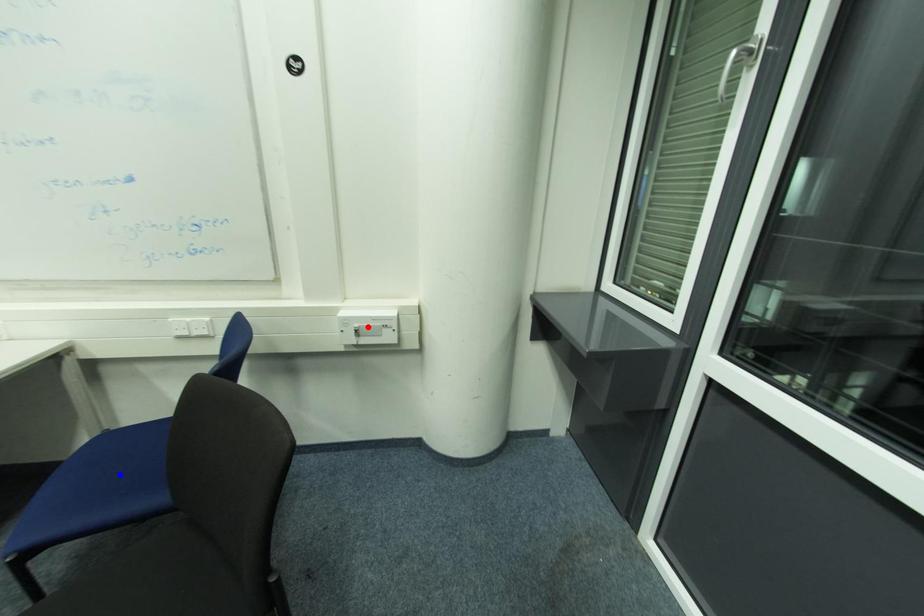
Question: In the image, two points are highlighted. Which point is nearer to the camera? Reply with the corresponding letter.

Choices:
 (A) blue point
 (B) red point

Answer: (A)